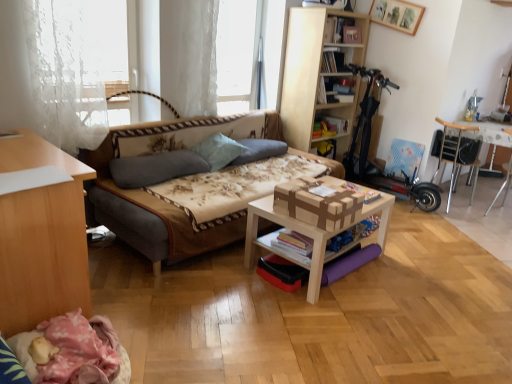
Question: Can white lace curtain at upper center be found inside floral fabric studio couch at center?

Choices:
 (A) yes
 (B) no

Answer: (B)

Question: Is floral fabric studio couch at center closer to camera compared to white lace curtain at upper center?

Choices:
 (A) no
 (B) yes

Answer: (B)

Question: Does floral fabric studio couch at center have a greater height compared to white lace curtain at upper center?

Choices:
 (A) no
 (B) yes

Answer: (A)

Question: Considering the relative sizes of floral fabric studio couch at center and white lace curtain at upper center in the image provided, is floral fabric studio couch at center smaller than white lace curtain at upper center?

Choices:
 (A) no
 (B) yes

Answer: (A)

Question: Can you confirm if floral fabric studio couch at center is wider than white lace curtain at upper center?

Choices:
 (A) yes
 (B) no

Answer: (A)

Question: Based on their positions, is hardcover book at center, which is the first book in bottom-to-top order, located to the left or right of light brown wooden table at center, which is the first table in front-to-back order?

Choices:
 (A) right
 (B) left

Answer: (B)

Question: From the image's perspective, is hardcover book at center, which is the first book in bottom-to-top order, located above or below light brown wooden table at center, which is the first table in front-to-back order?

Choices:
 (A) below
 (B) above

Answer: (A)

Question: In terms of width, does hardcover book at center, which appears as the 1th book when viewed from the front, look wider or thinner when compared to light brown wooden table at center, which is the first table in front-to-back order?

Choices:
 (A) thin
 (B) wide

Answer: (A)

Question: Considering the positions of hardcover book at center, which ranks as the 4th book in back-to-front order, and light brown wooden table at center, the 2th table in the right-to-left sequence, in the image, is hardcover book at center, which ranks as the 4th book in back-to-front order, taller or shorter than light brown wooden table at center, the 2th table in the right-to-left sequence,?

Choices:
 (A) short
 (B) tall

Answer: (A)

Question: In the image, is hardcover book at upper center, the first book from the top, positioned in front of or behind white lace curtain at upper center?

Choices:
 (A) front
 (B) behind

Answer: (B)

Question: In terms of width, does hardcover book at upper center, positioned as the 3th book in back-to-front order, look wider or thinner when compared to white lace curtain at upper center?

Choices:
 (A) thin
 (B) wide

Answer: (A)

Question: Visually, is hardcover book at upper center, positioned as the 3th book in back-to-front order, positioned to the left or to the right of white lace curtain at upper center?

Choices:
 (A) right
 (B) left

Answer: (A)

Question: From a real-world perspective, relative to white lace curtain at upper center, is hardcover book at upper center, the first book from the top, vertically above or below?

Choices:
 (A) above
 (B) below

Answer: (A)

Question: Would you say light blue fabric pillow at center, which appears as the second pillow when viewed from the left, is inside or outside hardcover book at upper center, the 4th book when ordered from bottom to top?

Choices:
 (A) inside
 (B) outside

Answer: (B)

Question: Based on their positions, is light blue fabric pillow at center, the 2th pillow in the right-to-left sequence, located to the left or right of hardcover book at upper center, positioned as the 3th book in back-to-front order?

Choices:
 (A) right
 (B) left

Answer: (B)